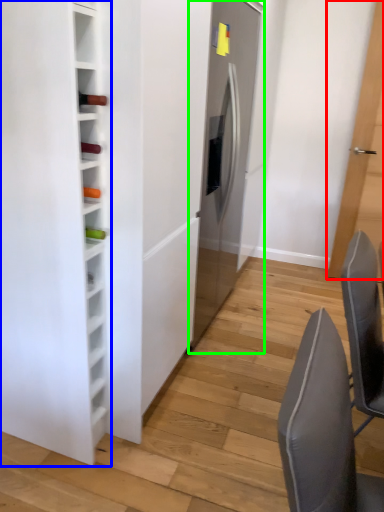
Question: Estimate the real-world distances between objects in this image. Which object is farther from door (highlighted by a red box), furniture (highlighted by a blue box) or fridge (highlighted by a green box)?

Choices:
 (A) furniture
 (B) fridge

Answer: (A)